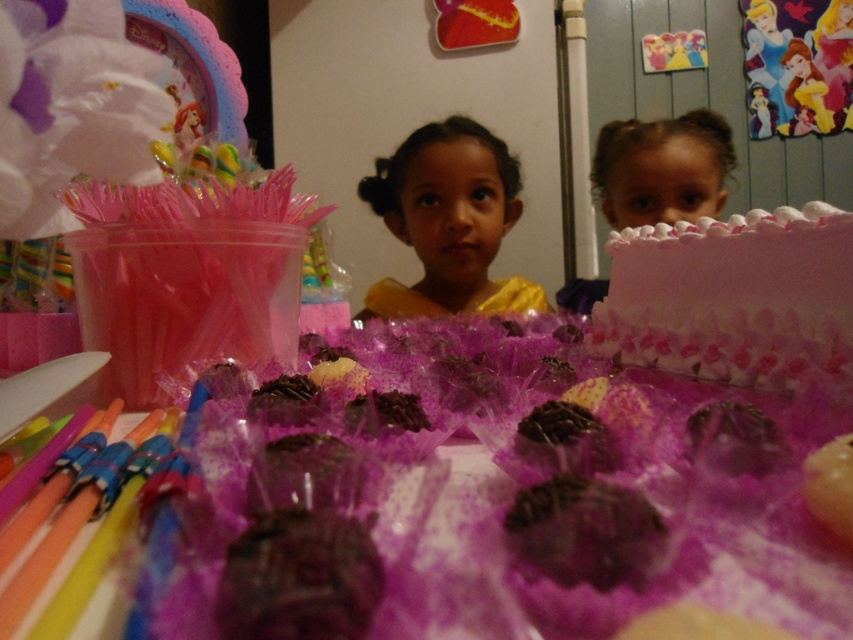
You are a guest at the birthday party and want to grab a piece of cake. The pink frosted cake at right and the smooth pink cake at upper right are both on the table. Which cake is located to the left of the other?

The pink frosted cake at right is to the left of the smooth pink cake at upper right.

What are the coordinates of the yellow satin dress at center?

The yellow satin dress at center is located at point (448, 221).